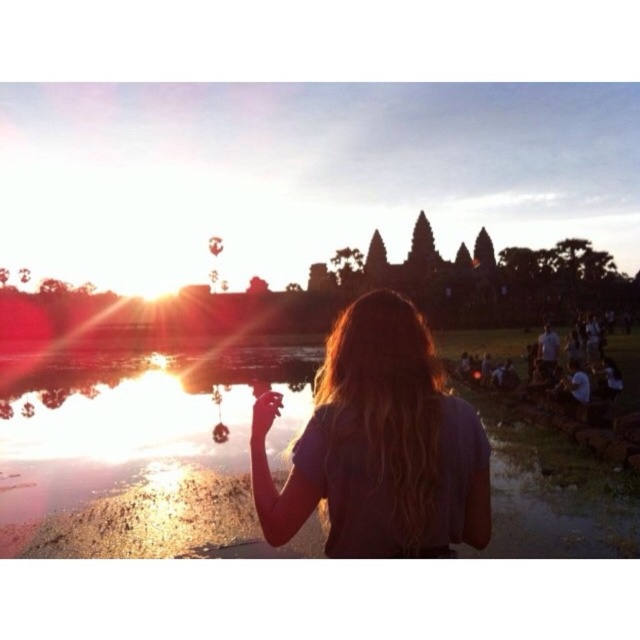
Does clear water at center lie behind blonde hair at center?

Yes, clear water at center is behind blonde hair at center.

Between clear water at center and blonde hair at center, which one is positioned higher?

blonde hair at center is higher up.

Between point (134, 456) and point (371, 426), which one is positioned behind?

The point (134, 456) is more distant.

The image size is (640, 640). Identify the location of clear water at center. click(x=140, y=451).